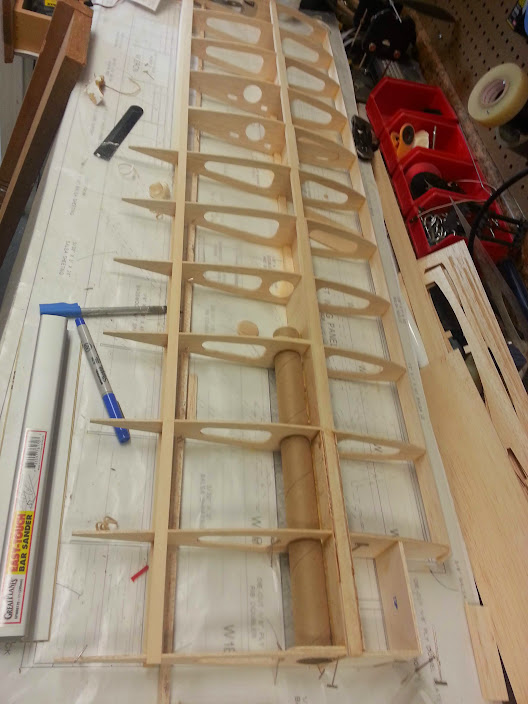
Where is `red cubbies for storage`? The width and height of the screenshot is (528, 704). red cubbies for storage is located at coordinates (443, 201), (447, 161), (443, 125), (441, 103).